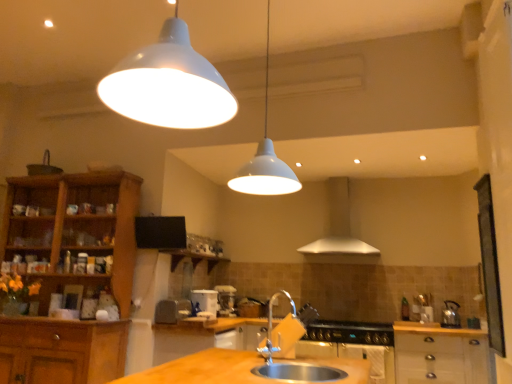
Question: Is white matte pendant light at upper center taller than wooden cabinet at left, arranged as the 2th cabinetry when viewed from the right?

Choices:
 (A) no
 (B) yes

Answer: (A)

Question: Is there a large distance between white matte pendant light at upper center and wooden cabinet at left, which ranks as the 1th cabinetry in left-to-right order?

Choices:
 (A) no
 (B) yes

Answer: (B)

Question: Is white matte pendant light at upper center smaller than wooden cabinet at left, arranged as the 2th cabinetry when viewed from the right?

Choices:
 (A) yes
 (B) no

Answer: (A)

Question: Can you confirm if white matte pendant light at upper center is wider than wooden cabinet at left, which ranks as the 1th cabinetry in left-to-right order?

Choices:
 (A) no
 (B) yes

Answer: (A)

Question: Can you see white matte pendant light at upper center touching wooden cabinet at left, arranged as the 2th cabinetry when viewed from the right?

Choices:
 (A) no
 (B) yes

Answer: (A)

Question: From the image's perspective, is white matte pendant light at upper center on top of wooden cabinet at left, which ranks as the 1th cabinetry in left-to-right order?

Choices:
 (A) yes
 (B) no

Answer: (A)

Question: From the image's perspective, does satin nickel faucet at sink center appear lower than matte plastic toaster at center, the first appliance when ordered from front to back?

Choices:
 (A) yes
 (B) no

Answer: (B)

Question: Can you confirm if satin nickel faucet at sink center is taller than matte plastic toaster at center, the first appliance when ordered from front to back?

Choices:
 (A) yes
 (B) no

Answer: (A)

Question: Can matte plastic toaster at center, which appears as the 2th appliance when viewed from the right, be found inside satin nickel faucet at sink center?

Choices:
 (A) yes
 (B) no

Answer: (B)

Question: Does satin nickel faucet at sink center appear on the left side of matte plastic toaster at center, which appears as the 2th appliance when viewed from the right?

Choices:
 (A) yes
 (B) no

Answer: (B)

Question: Can you confirm if satin nickel faucet at sink center is thinner than matte plastic toaster at center, which is the 1th appliance from left to right?

Choices:
 (A) yes
 (B) no

Answer: (A)

Question: From the image's perspective, is satin nickel faucet at sink center on matte plastic toaster at center, arranged as the second appliance when viewed from the back?

Choices:
 (A) yes
 (B) no

Answer: (A)

Question: Considering the relative sizes of stainless steel oven at lower center and black matte gas stove at lower center in the image provided, is stainless steel oven at lower center bigger than black matte gas stove at lower center?

Choices:
 (A) yes
 (B) no

Answer: (A)